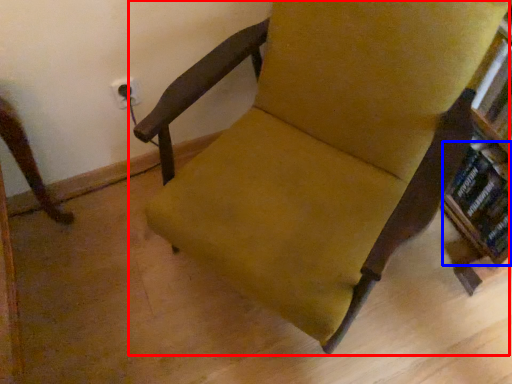
Question: Among these objects, which one is nearest to the camera, chair (highlighted by a red box) or book (highlighted by a blue box)?

Choices:
 (A) chair
 (B) book

Answer: (A)